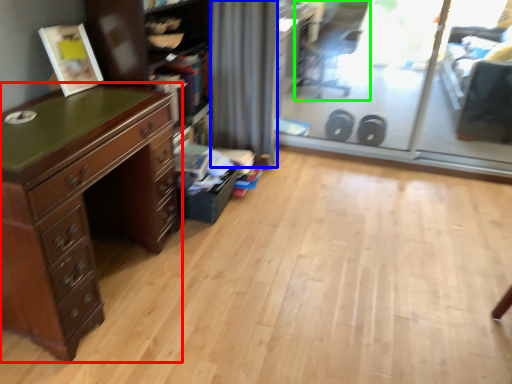
Question: Which object is positioned farthest from chest of drawers (highlighted by a red box)? Select from curtain (highlighted by a blue box) and swivel chair (highlighted by a green box).

Choices:
 (A) curtain
 (B) swivel chair

Answer: (B)